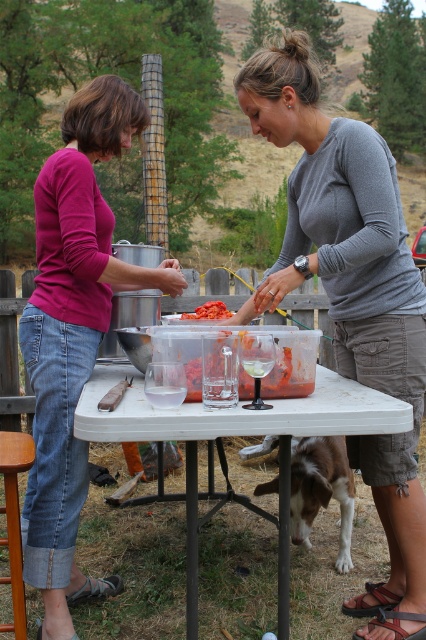
Who is positioned more to the left, translucent plastic container at center or bright red diced tomatoes at center?

From the viewer's perspective, bright red diced tomatoes at center appears more on the left side.

Which is below, translucent plastic container at center or bright red diced tomatoes at center?

Positioned lower is translucent plastic container at center.

Is point (287, 394) more distant than point (221, 307)?

No, it is in front of (221, 307).

The image size is (426, 640). What are the coordinates of `translucent plastic container at center` in the screenshot? It's located at (291, 364).

Locate an element on the screen. This screenshot has height=640, width=426. white plastic table at center is located at coordinates (236, 435).

Who is more distant from viewer, (285, 460) or (290, 380)?

The point (285, 460) is behind.

Locate an element on the screen. The image size is (426, 640). white plastic table at center is located at coordinates (236, 435).

Is translucent plastic container at center to the right of wooden stool at lower left from the viewer's perspective?

Correct, you'll find translucent plastic container at center to the right of wooden stool at lower left.

Does point (249, 385) lie in front of point (20, 589)?

That is True.

Is point (252, 380) positioned in front of point (28, 458)?

That is True.

Identify the location of translucent plastic container at center. (291, 364).